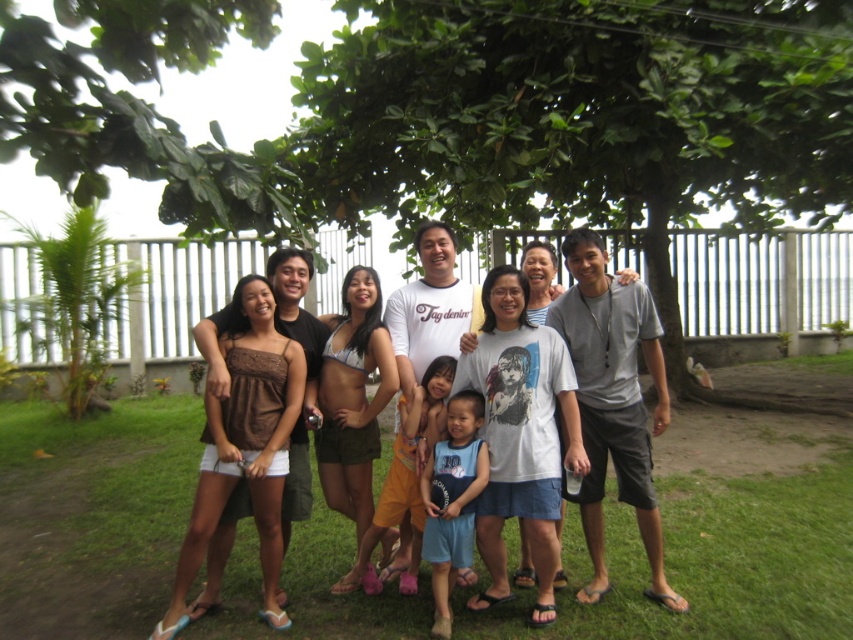
Does brown fabric dress at left come behind blue cotton shorts at center?

Yes, brown fabric dress at left is behind blue cotton shorts at center.

Does point (210, 339) come closer to viewer compared to point (485, 451)?

No, it is not.

Is point (221, 554) positioned before point (430, 509)?

No, (221, 554) is behind (430, 509).

Where is `brown fabric dress at left`? brown fabric dress at left is located at coordinates (305, 376).

Which is more to the left, green grass at center or green leafy tree at left?

green leafy tree at left is more to the left.

Is green grass at center further to the viewer compared to green leafy tree at left?

That is False.

The image size is (853, 640). Identify the location of green grass at center. (711, 563).

Image resolution: width=853 pixels, height=640 pixels. I want to click on green grass at center, so [x=711, y=563].

Which is more to the left, green grass at center or orange cotton shorts at center?

green grass at center is more to the left.

Which is behind, point (129, 477) or point (434, 380)?

Positioned behind is point (129, 477).

Does point (703, 524) come behind point (368, 573)?

Yes, it is.

In order to click on green grass at center in this screenshot , I will do `click(711, 563)`.